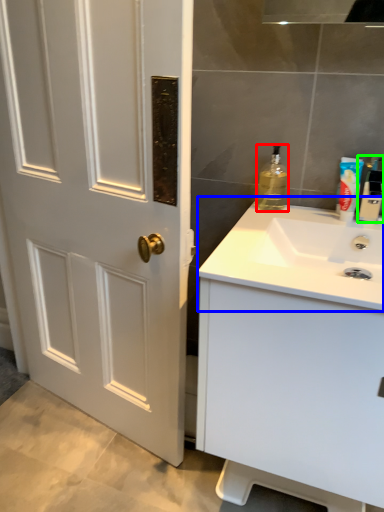
Question: Which object is positioned farthest from bottle (highlighted by a red box)? Select from sink (highlighted by a blue box) and bottle (highlighted by a green box).

Choices:
 (A) sink
 (B) bottle

Answer: (A)